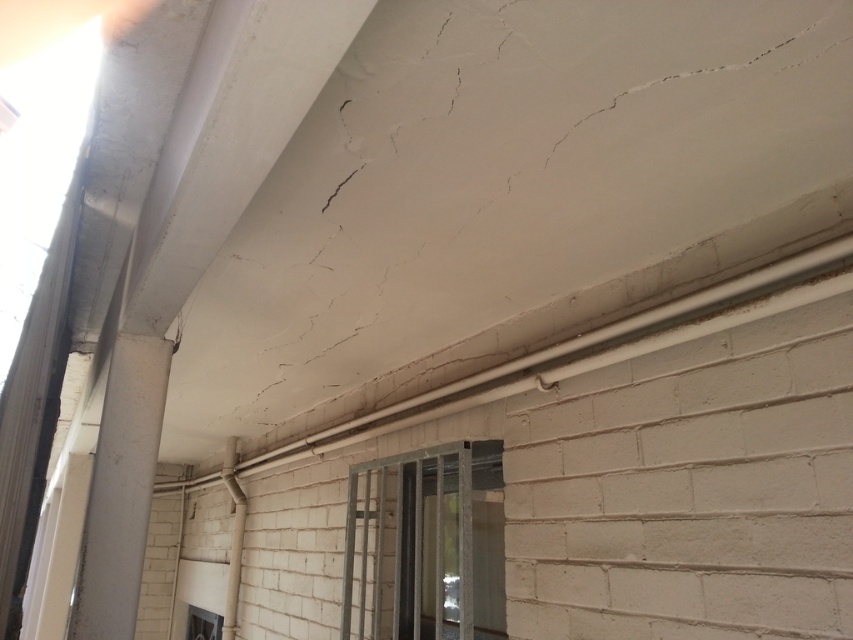
Can you confirm if metallic gray window at center is wider than transparent glass window at lower left?

Yes, metallic gray window at center is wider than transparent glass window at lower left.

Does metallic gray window at center have a greater height compared to transparent glass window at lower left?

Yes, metallic gray window at center is taller than transparent glass window at lower left.

Measure the distance between point [419,502] and camera.

Point [419,502] and camera are 8.65 feet apart.

Locate an element on the screen. The width and height of the screenshot is (853, 640). metallic gray window at center is located at coordinates (425, 545).